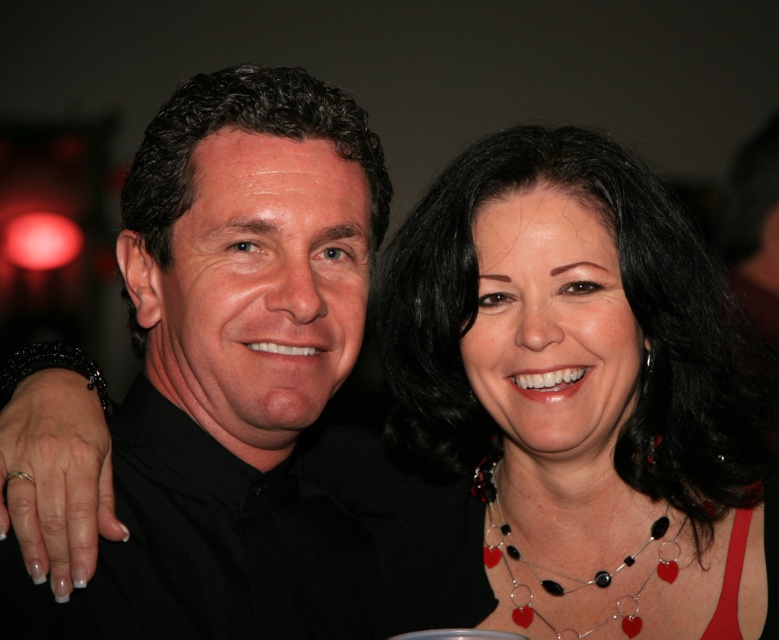
Question: Is black glossy necklace at upper center below black matte shirt at center?

Choices:
 (A) yes
 (B) no

Answer: (A)

Question: Is black glossy necklace at upper center bigger than black glass heart-shaped pendants at center?

Choices:
 (A) yes
 (B) no

Answer: (A)

Question: Estimate the real-world distances between objects in this image. Which object is closer to the black glass heart-shaped pendants at center?

Choices:
 (A) black matte shirt at center
 (B) black glossy necklace at upper center

Answer: (B)

Question: Which is nearer to the black matte shirt at center?

Choices:
 (A) black glass heart-shaped pendants at center
 (B) black glossy necklace at upper center

Answer: (B)

Question: Which object is positioned closest to the black matte shirt at center?

Choices:
 (A) black glass heart-shaped pendants at center
 (B) black glossy necklace at upper center

Answer: (B)

Question: Can you confirm if black glossy necklace at upper center is thinner than black glass heart-shaped pendants at center?

Choices:
 (A) no
 (B) yes

Answer: (A)